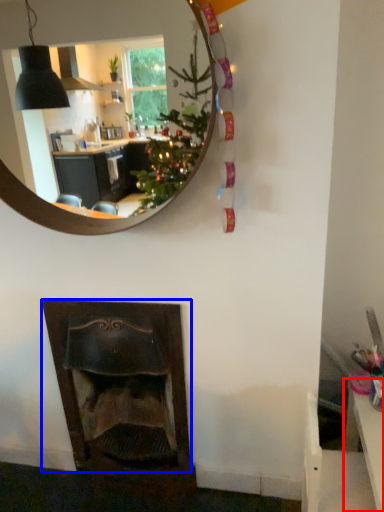
Question: Which object appears closest to the camera in this image, table (highlighted by a red box) or fireplace (highlighted by a blue box)?

Choices:
 (A) table
 (B) fireplace

Answer: (A)